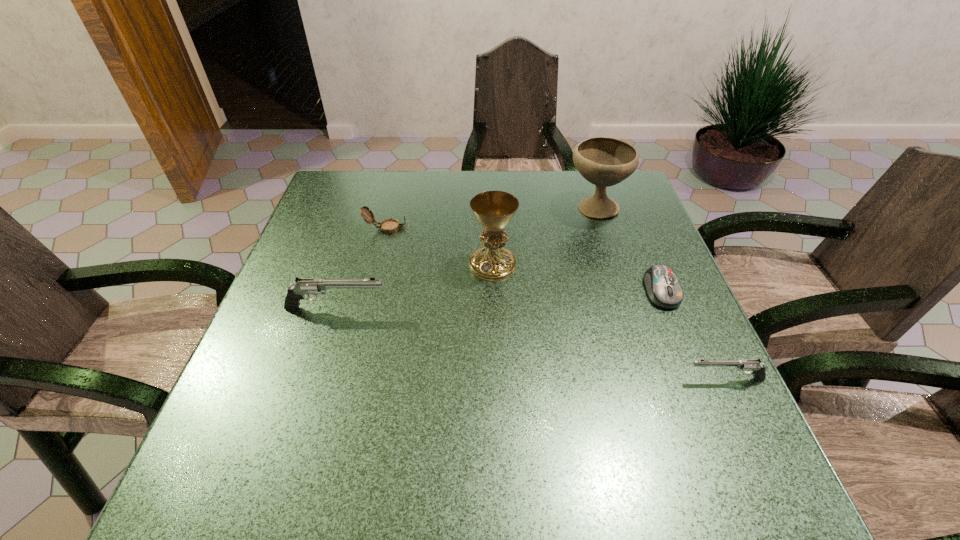
If equal spacing is the goal by inserting an additional pistol among them, please point out a vacant space for this new pistol. Please provide its 2D coordinates. Your answer should be formatted as a tuple, i.e. [(x, y)], where the tuple contains the x and y coordinates of a point satisfying the conditions above.

[(516, 341)]